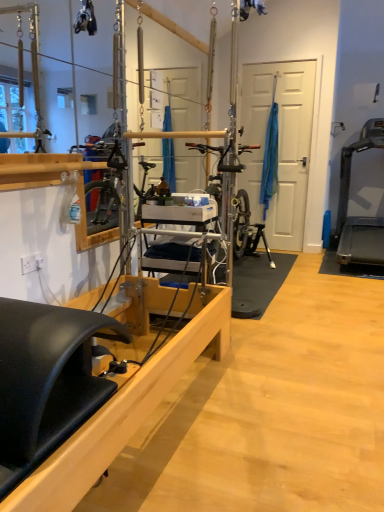
Question: Is wooden pilates reformer at center wider or thinner than black plastic treadmill at right?

Choices:
 (A) wide
 (B) thin

Answer: (A)

Question: Considering their positions, is wooden pilates reformer at center located in front of or behind black plastic treadmill at right?

Choices:
 (A) behind
 (B) front

Answer: (B)

Question: From the image's perspective, is wooden pilates reformer at center above or below black plastic treadmill at right?

Choices:
 (A) below
 (B) above

Answer: (A)

Question: Is black plastic treadmill at right wider or thinner than wooden pilates reformer at center?

Choices:
 (A) thin
 (B) wide

Answer: (A)

Question: Considering their positions, is black plastic treadmill at right located in front of or behind wooden pilates reformer at center?

Choices:
 (A) behind
 (B) front

Answer: (A)

Question: Which is correct: black plastic treadmill at right is inside wooden pilates reformer at center, or outside of it?

Choices:
 (A) outside
 (B) inside

Answer: (A)

Question: From the image's perspective, is black plastic treadmill at right above or below wooden pilates reformer at center?

Choices:
 (A) below
 (B) above

Answer: (B)